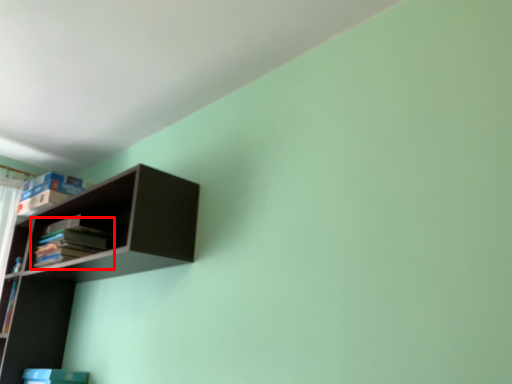
Question: From the image's perspective, considering the relative positions of book (annotated by the red box) and shelf in the image provided, where is book (annotated by the red box) located with respect to the staircase?

Choices:
 (A) above
 (B) below

Answer: (A)